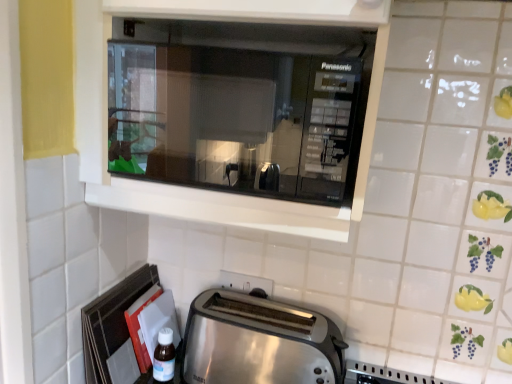
Question: Is white plastic electric outlet at lower center further to camera compared to black glass microwave at upper center?

Choices:
 (A) no
 (B) yes

Answer: (B)

Question: Is white plastic electric outlet at lower center facing away from black glass microwave at upper center?

Choices:
 (A) no
 (B) yes

Answer: (A)

Question: Considering the relative sizes of white plastic electric outlet at lower center and black glass microwave at upper center in the image provided, is white plastic electric outlet at lower center wider than black glass microwave at upper center?

Choices:
 (A) no
 (B) yes

Answer: (A)

Question: Considering the relative sizes of white plastic electric outlet at lower center and black glass microwave at upper center in the image provided, is white plastic electric outlet at lower center smaller than black glass microwave at upper center?

Choices:
 (A) yes
 (B) no

Answer: (A)

Question: From the image's perspective, is white plastic electric outlet at lower center on black glass microwave at upper center?

Choices:
 (A) no
 (B) yes

Answer: (A)

Question: Looking at their shapes, would you say black glass microwave at upper center is wider or thinner than transparent plastic bottle at lower left?

Choices:
 (A) wide
 (B) thin

Answer: (A)

Question: Which is correct: black glass microwave at upper center is inside transparent plastic bottle at lower left, or outside of it?

Choices:
 (A) inside
 (B) outside

Answer: (B)

Question: Visually, is black glass microwave at upper center positioned to the left or to the right of transparent plastic bottle at lower left?

Choices:
 (A) right
 (B) left

Answer: (A)

Question: Relative to transparent plastic bottle at lower left, is black glass microwave at upper center in front or behind?

Choices:
 (A) behind
 (B) front

Answer: (B)

Question: Is black glass microwave at upper center inside the boundaries of satin silver toaster at lower center, or outside?

Choices:
 (A) outside
 (B) inside

Answer: (A)

Question: Looking at the image, does black glass microwave at upper center seem bigger or smaller compared to satin silver toaster at lower center?

Choices:
 (A) small
 (B) big

Answer: (B)

Question: From a real-world perspective, is black glass microwave at upper center positioned above or below satin silver toaster at lower center?

Choices:
 (A) above
 (B) below

Answer: (A)

Question: In terms of width, does black glass microwave at upper center look wider or thinner when compared to satin silver toaster at lower center?

Choices:
 (A) thin
 (B) wide

Answer: (B)

Question: Looking at the image, does satin silver toaster at lower center seem bigger or smaller compared to transparent plastic bottle at lower left?

Choices:
 (A) small
 (B) big

Answer: (B)

Question: From the image's perspective, is satin silver toaster at lower center located above or below transparent plastic bottle at lower left?

Choices:
 (A) below
 (B) above

Answer: (B)